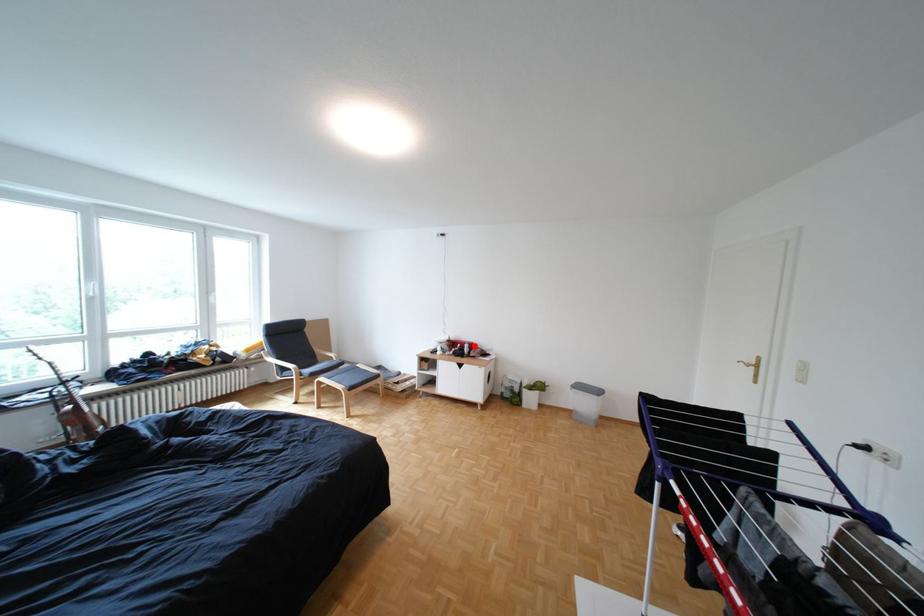
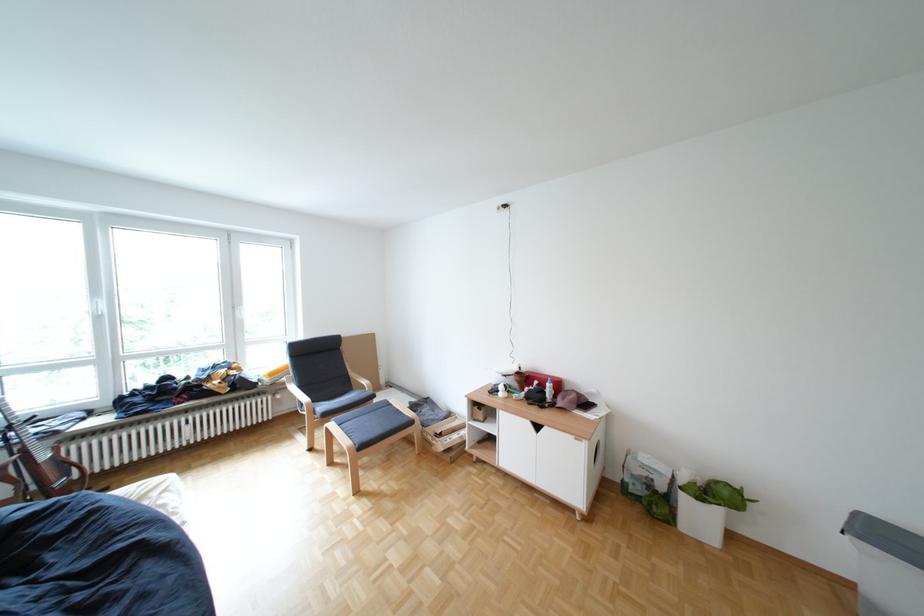
Locate, in the second image, the point that corresponds to the highlighted location in the first image.

(552, 383)